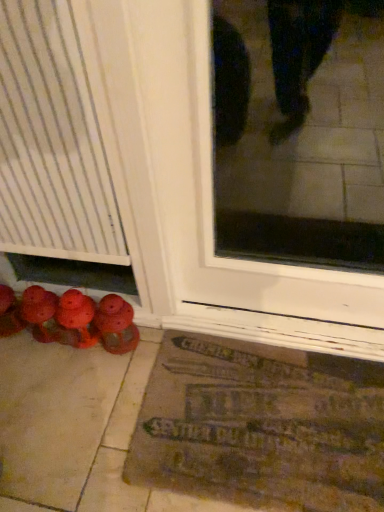
Find the location of a particular element. The image size is (384, 512). vacant area situated below brown textured mat at lower center (from a real-world perspective) is located at coordinates (268, 428).